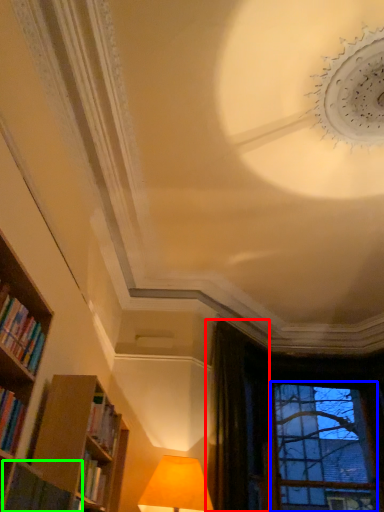
Question: Which object is the farthest from curtain (highlighted by a red box)? Choose among these: bay window (highlighted by a blue box) or book (highlighted by a green box).

Choices:
 (A) bay window
 (B) book

Answer: (B)